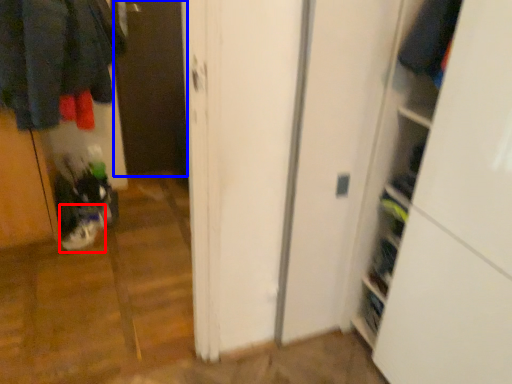
Question: Among these objects, which one is farthest to the camera, footwear (highlighted by a red box) or screen door (highlighted by a blue box)?

Choices:
 (A) footwear
 (B) screen door

Answer: (B)